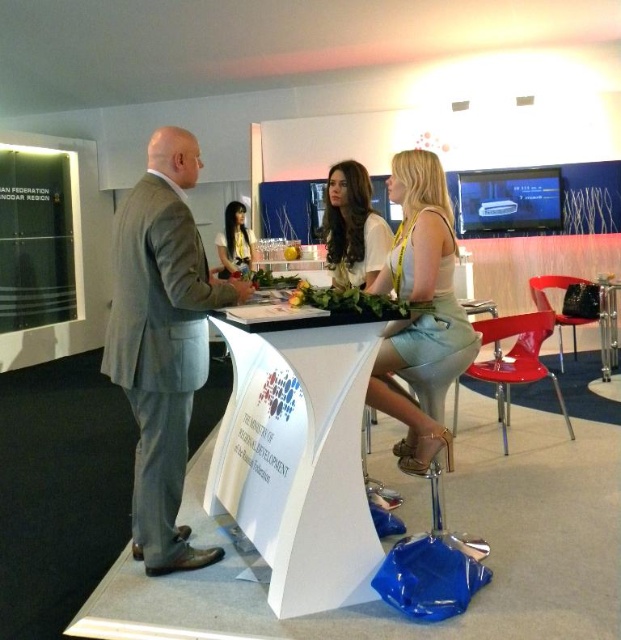
Does white fabric dress at center have a lesser height compared to smooth white blouse at center?

Yes.

Does white fabric dress at center have a larger size compared to smooth white blouse at center?

Actually, white fabric dress at center might be smaller than smooth white blouse at center.

Is point (342, 230) positioned after point (252, 241)?

No.

The image size is (621, 640). I want to click on white fabric dress at center, so (351, 227).

Is light blue fabric dress at center shorter than smooth white blouse at center?

No.

Can you confirm if light blue fabric dress at center is positioned above smooth white blouse at center?

Incorrect, light blue fabric dress at center is not positioned above smooth white blouse at center.

Which is in front, point (458, 330) or point (237, 209)?

Point (458, 330) is in front.

Locate an element on the screen. The height and width of the screenshot is (640, 621). light blue fabric dress at center is located at coordinates (419, 305).

Between light blue fabric dress at center and clear acrylic table at center, which one appears on the left side from the viewer's perspective?

From the viewer's perspective, light blue fabric dress at center appears more on the left side.

Can you confirm if light blue fabric dress at center is shorter than clear acrylic table at center?

No, light blue fabric dress at center is not shorter than clear acrylic table at center.

Measure the distance between light blue fabric dress at center and camera.

light blue fabric dress at center is 7.36 feet away from camera.

The height and width of the screenshot is (640, 621). In order to click on light blue fabric dress at center in this screenshot , I will do `click(419, 305)`.